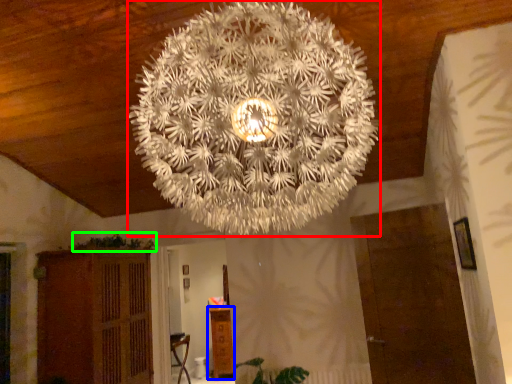
Question: Based on their relative distances, which object is nearer to lamp (highlighted by a red box)? Choose from furniture (highlighted by a blue box) and plant (highlighted by a green box).

Choices:
 (A) furniture
 (B) plant

Answer: (B)